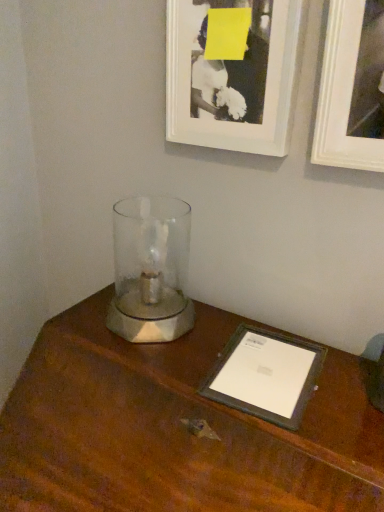
I want to click on free point above brown wood table at center (from a real-world perspective), so (218, 366).